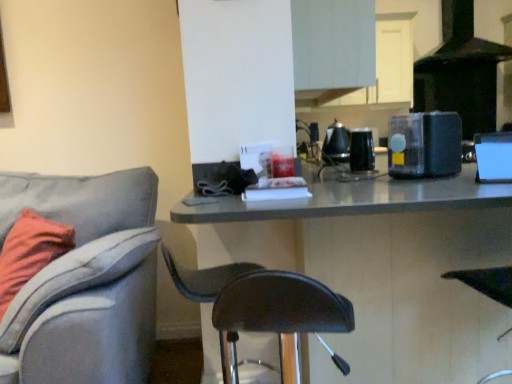
Question: Is black glossy coffee maker at upper center, marked as the 2th appliance in a back-to-front arrangement, oriented away from black matte exhaust hood at upper right?

Choices:
 (A) yes
 (B) no

Answer: (B)

Question: Is black glossy coffee maker at upper center, marked as the 2th appliance in a back-to-front arrangement, closer to camera compared to black matte exhaust hood at upper right?

Choices:
 (A) yes
 (B) no

Answer: (A)

Question: Can you confirm if black glossy coffee maker at upper center, which ranks as the third appliance in front-to-back order, is taller than black matte exhaust hood at upper right?

Choices:
 (A) no
 (B) yes

Answer: (A)

Question: From a real-world perspective, is black glossy coffee maker at upper center, marked as the 2th appliance in a back-to-front arrangement, on top of black matte exhaust hood at upper right?

Choices:
 (A) no
 (B) yes

Answer: (A)

Question: Would you say black matte exhaust hood at upper right is part of black glossy coffee maker at upper center, marked as the 2th appliance in a back-to-front arrangement,'s contents?

Choices:
 (A) no
 (B) yes

Answer: (A)

Question: Is black glossy coffee maker at upper center, marked as the 2th appliance in a back-to-front arrangement, at the left side of black matte exhaust hood at upper right?

Choices:
 (A) no
 (B) yes

Answer: (B)

Question: Can you see black plastic blender at upper right, which appears as the 3th appliance when viewed from the back, touching black matte exhaust hood at upper right?

Choices:
 (A) no
 (B) yes

Answer: (A)

Question: From the image's perspective, is black plastic blender at upper right, which appears as the 3th appliance when viewed from the back, located beneath black matte exhaust hood at upper right?

Choices:
 (A) yes
 (B) no

Answer: (A)

Question: Considering the relative sizes of black plastic blender at upper right, which appears as the 2th appliance when viewed from the front, and black matte exhaust hood at upper right in the image provided, is black plastic blender at upper right, which appears as the 2th appliance when viewed from the front, thinner than black matte exhaust hood at upper right?

Choices:
 (A) yes
 (B) no

Answer: (A)

Question: Is black plastic blender at upper right, which appears as the 2th appliance when viewed from the front, not inside black matte exhaust hood at upper right?

Choices:
 (A) no
 (B) yes

Answer: (B)

Question: Can you confirm if black plastic blender at upper right, which appears as the 3th appliance when viewed from the back, is wider than black matte exhaust hood at upper right?

Choices:
 (A) yes
 (B) no

Answer: (B)

Question: Considering the relative positions of black plastic blender at upper right, which appears as the 3th appliance when viewed from the back, and black matte exhaust hood at upper right in the image provided, is black plastic blender at upper right, which appears as the 3th appliance when viewed from the back, to the right of black matte exhaust hood at upper right from the viewer's perspective?

Choices:
 (A) yes
 (B) no

Answer: (B)

Question: Is black plastic blender at upper right, which appears as the 2th appliance when viewed from the front, positioned in front of blue glossy speaker at right, which is the fourth appliance in back-to-front order?

Choices:
 (A) yes
 (B) no

Answer: (B)